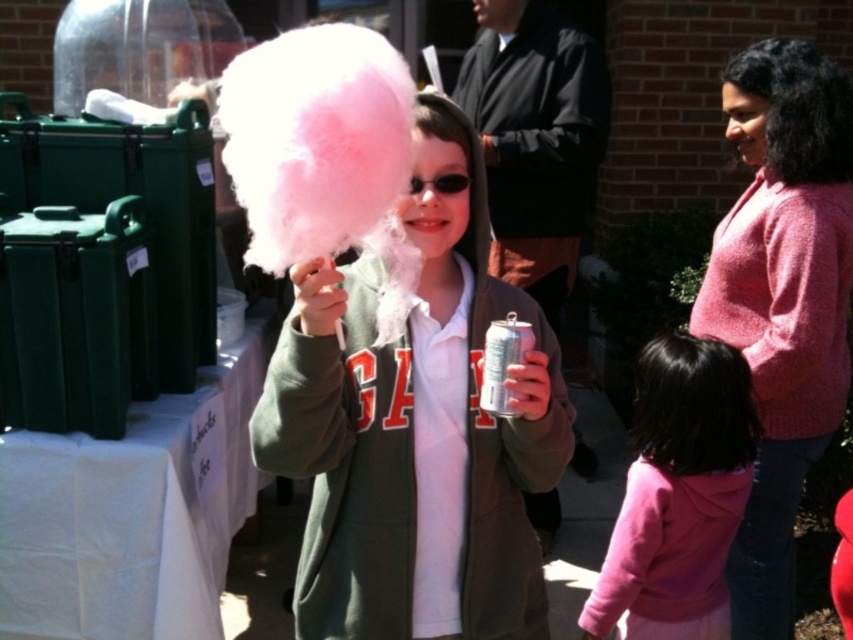
Question: Is pink fluffy cotton candy at center to the left of pink fleece jacket at lower right from the viewer's perspective?

Choices:
 (A) yes
 (B) no

Answer: (A)

Question: Which point is closer to the camera taking this photo?

Choices:
 (A) (383, 577)
 (B) (668, 348)

Answer: (A)

Question: Is pink fluffy cotton candy at center positioned at the back of pink fleece jacket at lower right?

Choices:
 (A) no
 (B) yes

Answer: (A)

Question: Is pink fluffy cotton candy at center thinner than pink fleece jacket at lower right?

Choices:
 (A) no
 (B) yes

Answer: (A)